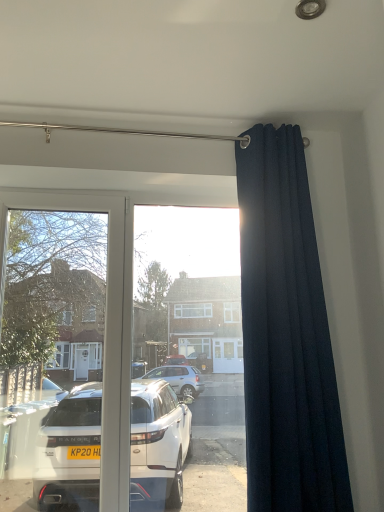
Image resolution: width=384 pixels, height=512 pixels. What do you see at coordinates (286, 336) in the screenshot?
I see `dark blue fabric curtain at right` at bounding box center [286, 336].

The height and width of the screenshot is (512, 384). In order to click on dark blue fabric curtain at right in this screenshot , I will do `click(286, 336)`.

I want to click on dark blue fabric curtain at right, so click(x=286, y=336).